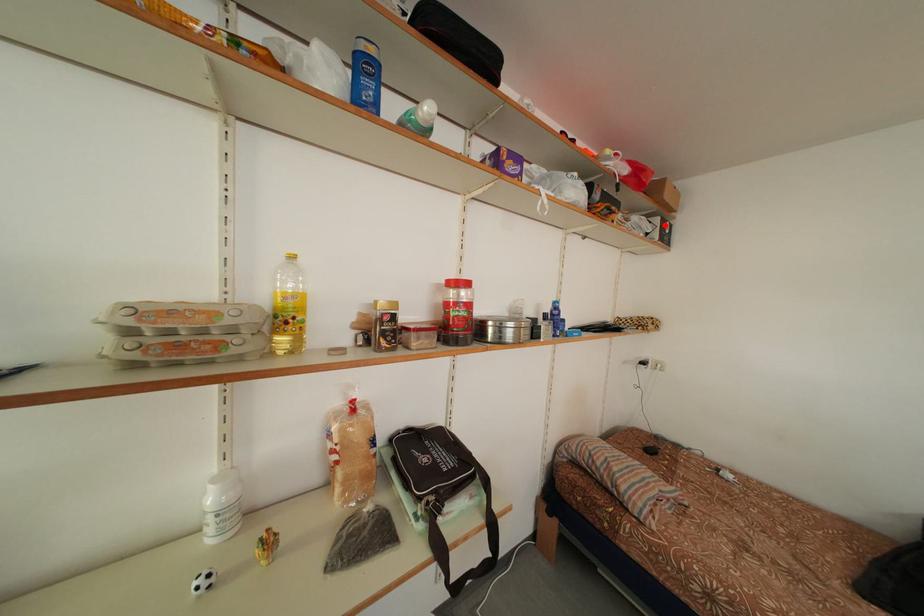
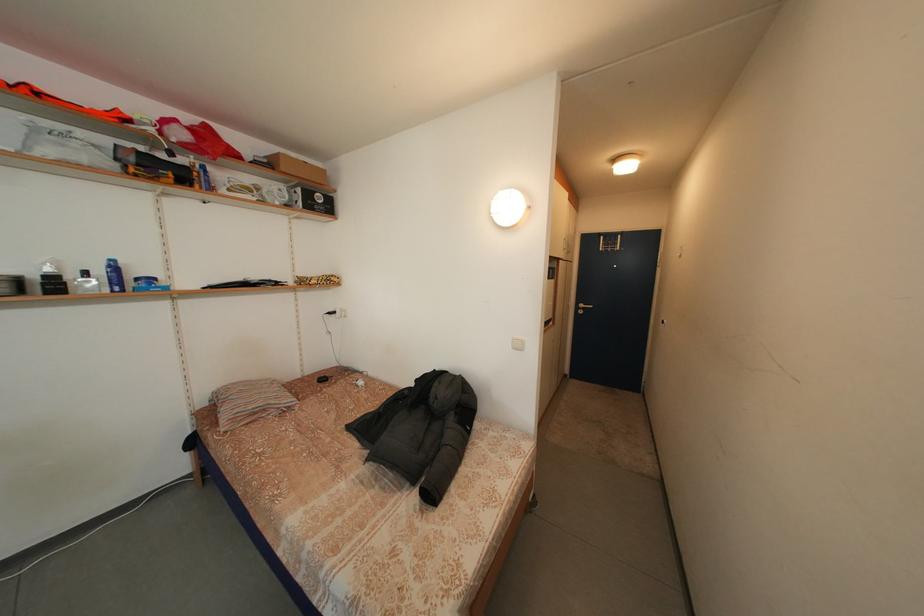
Locate, in the second image, the point that corresponds to the highlighted location in the first image.

(307, 196)